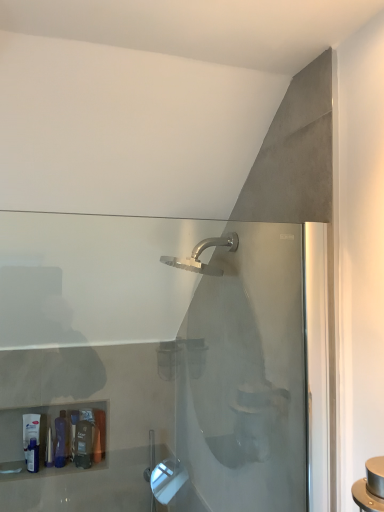
Question: Is translucent plastic bottle at lower left, the third toiletry viewed from the left, at the right side of translucent plastic tube at lower left, which appears as the 2th toiletry when viewed from the right?

Choices:
 (A) no
 (B) yes

Answer: (B)

Question: From a real-world perspective, is translucent plastic bottle at lower left, placed as the 1th toiletry when sorted from right to left, over translucent plastic tube at lower left, which is the second toiletry from left to right?

Choices:
 (A) no
 (B) yes

Answer: (A)

Question: Is translucent plastic bottle at lower left, the third toiletry viewed from the left, far from translucent plastic tube at lower left, which is the second toiletry from left to right?

Choices:
 (A) yes
 (B) no

Answer: (B)

Question: Could you tell me if translucent plastic bottle at lower left, placed as the 1th toiletry when sorted from right to left, is facing translucent plastic tube at lower left, which is the second toiletry from left to right?

Choices:
 (A) yes
 (B) no

Answer: (B)

Question: Is translucent plastic tube at lower left, which appears as the 2th toiletry when viewed from the right, inside translucent plastic bottle at lower left, placed as the 1th toiletry when sorted from right to left?

Choices:
 (A) yes
 (B) no

Answer: (B)

Question: Is matte white tube at lower left, the 3th toiletry in the right-to-left sequence, taller or shorter than translucent plastic tube at lower left, which is the second toiletry from left to right?

Choices:
 (A) short
 (B) tall

Answer: (B)

Question: Is matte white tube at lower left, arranged as the first toiletry when viewed from the left, bigger or smaller than translucent plastic tube at lower left, which appears as the 2th toiletry when viewed from the right?

Choices:
 (A) small
 (B) big

Answer: (B)

Question: Is matte white tube at lower left, the 3th toiletry in the right-to-left sequence, wider or thinner than translucent plastic tube at lower left, which is the second toiletry from left to right?

Choices:
 (A) thin
 (B) wide

Answer: (A)

Question: In the image, is matte white tube at lower left, the 3th toiletry in the right-to-left sequence, on the left side or the right side of translucent plastic tube at lower left, which appears as the 2th toiletry when viewed from the right?

Choices:
 (A) left
 (B) right

Answer: (A)

Question: Looking at the image, does translucent plastic bottle at lower left, placed as the 1th toiletry when sorted from right to left, seem bigger or smaller compared to translucent plastic tube at lower left, which is the second toiletry from left to right?

Choices:
 (A) big
 (B) small

Answer: (B)

Question: Considering the positions of translucent plastic bottle at lower left, the third toiletry viewed from the left, and translucent plastic tube at lower left, which is the second toiletry from left to right, in the image, is translucent plastic bottle at lower left, the third toiletry viewed from the left, taller or shorter than translucent plastic tube at lower left, which is the second toiletry from left to right,?

Choices:
 (A) tall
 (B) short

Answer: (A)

Question: In the image, is translucent plastic bottle at lower left, placed as the 1th toiletry when sorted from right to left, positioned in front of or behind translucent plastic tube at lower left, which is the second toiletry from left to right?

Choices:
 (A) front
 (B) behind

Answer: (A)

Question: Is translucent plastic bottle at lower left, the third toiletry viewed from the left, to the left or to the right of translucent plastic tube at lower left, which appears as the 2th toiletry when viewed from the right, in the image?

Choices:
 (A) left
 (B) right

Answer: (B)

Question: Is translucent plastic bottle at lower left, placed as the 1th toiletry when sorted from right to left, taller or shorter than matte white tube at lower left, arranged as the first toiletry when viewed from the left?

Choices:
 (A) short
 (B) tall

Answer: (A)

Question: Considering the positions of translucent plastic bottle at lower left, placed as the 1th toiletry when sorted from right to left, and matte white tube at lower left, arranged as the first toiletry when viewed from the left, in the image, is translucent plastic bottle at lower left, placed as the 1th toiletry when sorted from right to left, wider or thinner than matte white tube at lower left, arranged as the first toiletry when viewed from the left,?

Choices:
 (A) wide
 (B) thin

Answer: (A)